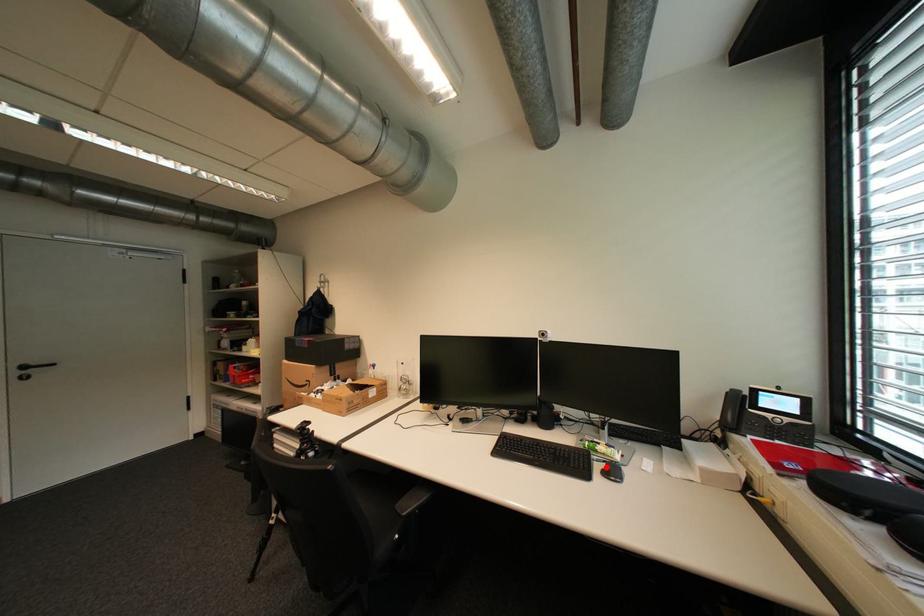
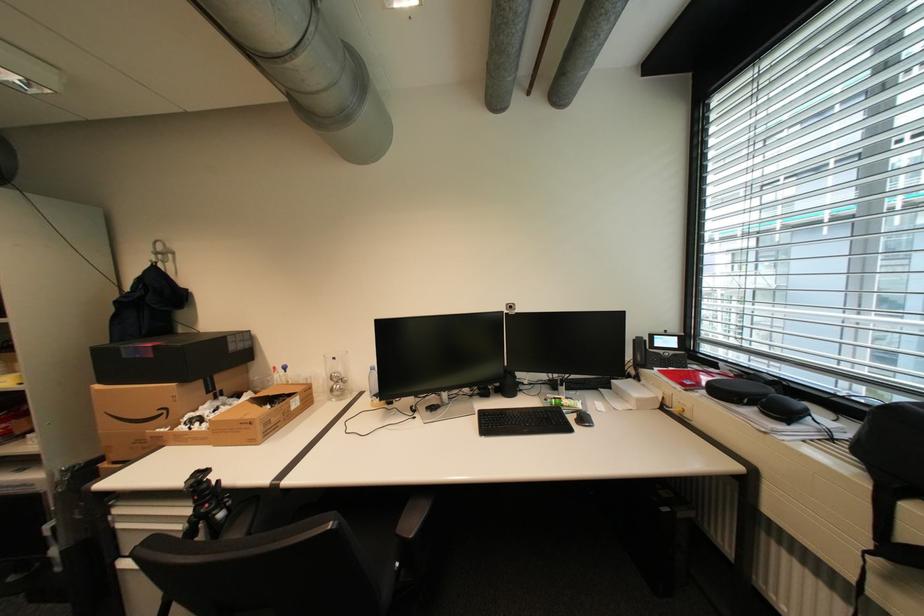
Where in the second image is the point corresponding to the highlighted location from the first image?

(579, 419)